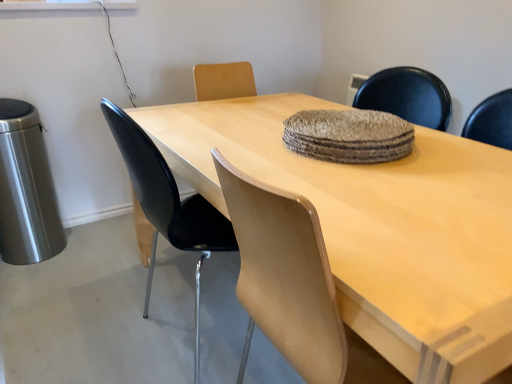
Where is `vacant area to the right of textured woven mat at center`? vacant area to the right of textured woven mat at center is located at coordinates (458, 154).